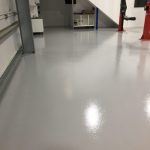
Where is `caster wheels`? caster wheels is located at coordinates (33, 51), (23, 52).